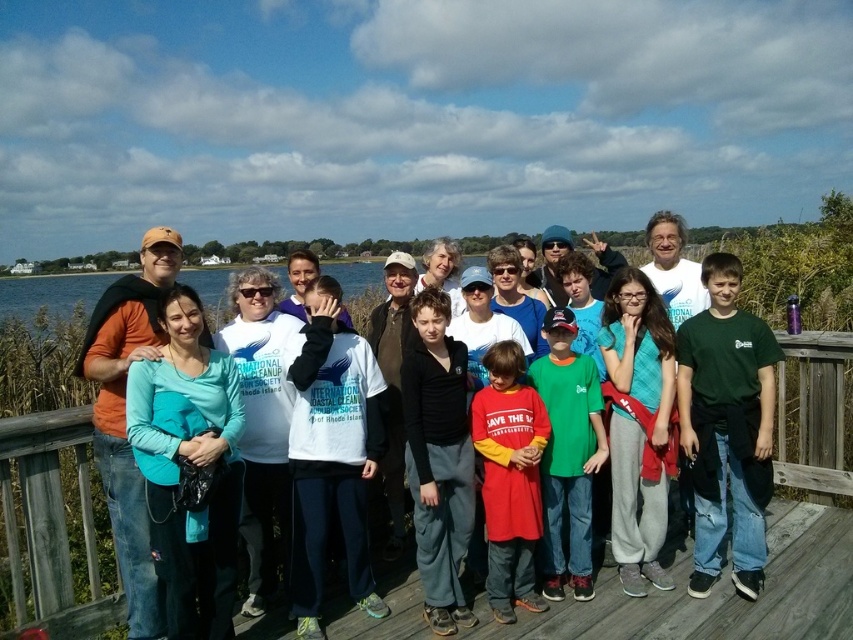
You are a photographer standing on the wooden deck. You need to take a group photo of the matte orange shirt at left and the red cotton shirt at center. The minimum distance required for your camera to focus properly is 2 meters. Can you capture both subjects clearly in the same photo without moving them?

The distance between the matte orange shirt at left and the red cotton shirt at center is 1.99 meters, which is just below the 2 meter minimum required for the camera to focus properly. Therefore, the photographer cannot capture both subjects clearly in the same photo without moving them.